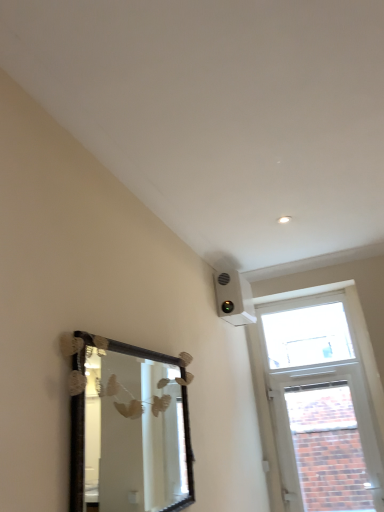
Question: From the image's perspective, is brick textured window at upper right, which ranks as the 2th window in top-to-bottom order, above wooden-framed mirror at lower left?

Choices:
 (A) no
 (B) yes

Answer: (A)

Question: Does brick textured window at upper right, which ranks as the 2th window in top-to-bottom order, come behind wooden-framed mirror at lower left?

Choices:
 (A) no
 (B) yes

Answer: (B)

Question: Is brick textured window at upper right, which is the 1th window in bottom-to-top order, located outside wooden-framed mirror at lower left?

Choices:
 (A) no
 (B) yes

Answer: (B)

Question: Can you confirm if brick textured window at upper right, which ranks as the 2th window in top-to-bottom order, is positioned to the left of wooden-framed mirror at lower left?

Choices:
 (A) yes
 (B) no

Answer: (B)

Question: Is brick textured window at upper right, which ranks as the 2th window in top-to-bottom order, shorter than wooden-framed mirror at lower left?

Choices:
 (A) yes
 (B) no

Answer: (B)

Question: From the image's perspective, relative to wooden-framed mirror at lower left, is brick textured window at upper right, which ranks as the 2th window in top-to-bottom order, above or below?

Choices:
 (A) below
 (B) above

Answer: (A)

Question: Is brick textured window at upper right, which is the 1th window in bottom-to-top order, inside the boundaries of wooden-framed mirror at lower left, or outside?

Choices:
 (A) outside
 (B) inside

Answer: (A)

Question: From a real-world perspective, is brick textured window at upper right, which is the 1th window in bottom-to-top order, above or below wooden-framed mirror at lower left?

Choices:
 (A) above
 (B) below

Answer: (B)

Question: Is brick textured window at upper right, which ranks as the 2th window in top-to-bottom order, wider or thinner than wooden-framed mirror at lower left?

Choices:
 (A) thin
 (B) wide

Answer: (B)

Question: In terms of size, does transparent glass window at upper right, which is the second window in bottom-to-top order, appear bigger or smaller than brick textured window at upper right, which is the 1th window in bottom-to-top order?

Choices:
 (A) small
 (B) big

Answer: (A)

Question: In terms of width, does transparent glass window at upper right, the 1th window when ordered from top to bottom, look wider or thinner when compared to brick textured window at upper right, which ranks as the 2th window in top-to-bottom order?

Choices:
 (A) wide
 (B) thin

Answer: (B)

Question: From the image's perspective, is transparent glass window at upper right, the 1th window when ordered from top to bottom, above or below brick textured window at upper right, which is the 1th window in bottom-to-top order?

Choices:
 (A) above
 (B) below

Answer: (A)

Question: Would you say transparent glass window at upper right, the 1th window when ordered from top to bottom, is inside or outside brick textured window at upper right, which is the 1th window in bottom-to-top order?

Choices:
 (A) inside
 (B) outside

Answer: (B)

Question: Is point (321, 396) positioned closer to the camera than point (352, 355)?

Choices:
 (A) closer
 (B) farther

Answer: (B)

Question: From a real-world perspective, is brick textured window at upper right, which ranks as the 2th window in top-to-bottom order, above or below transparent glass window at upper right, which is the second window in bottom-to-top order?

Choices:
 (A) below
 (B) above

Answer: (A)